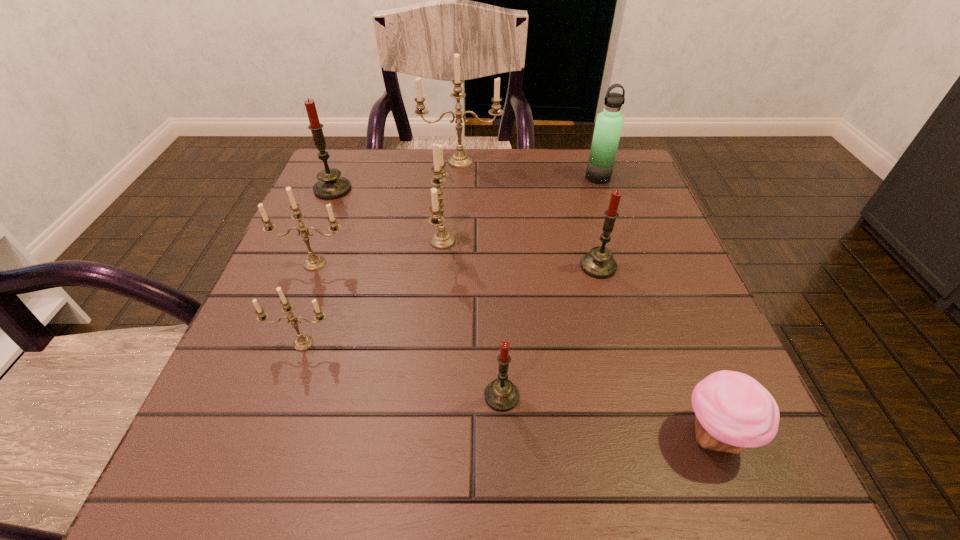
Where is `the farthest candle`? Image resolution: width=960 pixels, height=540 pixels. the farthest candle is located at coordinates (459, 160).

Find the location of a particular element. This screenshot has width=960, height=540. the biggest metallic candle is located at coordinates (459, 160).

The image size is (960, 540). Find the location of `thermos bottle`. thermos bottle is located at coordinates (609, 123).

Locate an element on the screen. This screenshot has height=540, width=960. the leftmost red candle is located at coordinates (330, 186).

You are a GUI agent. You are given a task and a screenshot of the screen. Output one action in this format:
    pyautogui.click(x=<x>, y=<y>)
    Task: Click on the sixth nearest candle
    This screenshot has width=960, height=540.
    Given the screenshot: What is the action you would take?
    pyautogui.click(x=330, y=186)

At what (x,y) coordinates should I click in order to perform the action: click on the second biggest metallic candle. Please return your answer as a coordinate pair (x, y). The height and width of the screenshot is (540, 960). Looking at the image, I should click on (441, 240).

Where is `the second nearest red candle`? Image resolution: width=960 pixels, height=540 pixels. the second nearest red candle is located at coordinates (599, 263).

At what (x,y) coordinates should I click in order to perform the action: click on the rightmost red candle. Please return your answer as a coordinate pair (x, y). This screenshot has height=540, width=960. Looking at the image, I should click on (599, 263).

You are a GUI agent. You are given a task and a screenshot of the screen. Output one action in this format:
    pyautogui.click(x=<x>, y=<y>)
    Task: Click on the second smallest metallic candle
    The image size is (960, 540).
    Given the screenshot: What is the action you would take?
    pyautogui.click(x=314, y=262)

This screenshot has height=540, width=960. I want to click on the nearest red candle, so click(501, 395).